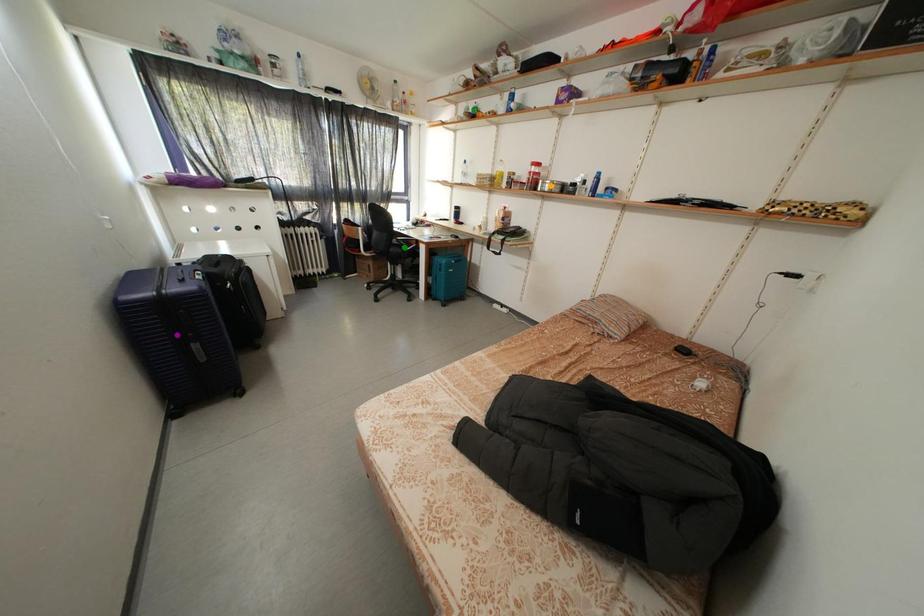
Order these from nearest to farthest:
green point, purple point, orange point

1. green point
2. orange point
3. purple point